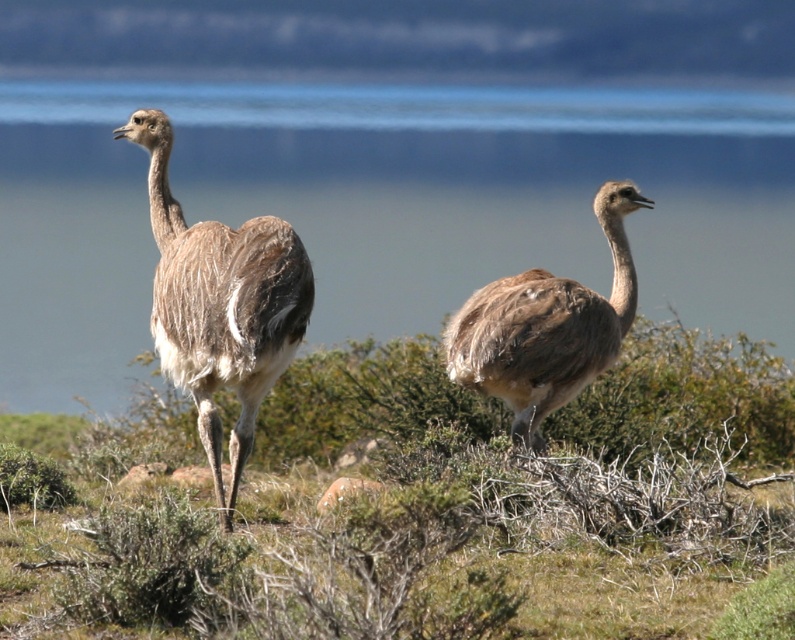
Can you confirm if blue water at center is wider than brown feathered ostrich at center?

Indeed, blue water at center has a greater width compared to brown feathered ostrich at center.

Is point (33, 330) farther from viewer compared to point (569, 355)?

Yes, it is.

Identify the location of blue water at center. Image resolution: width=795 pixels, height=640 pixels. (382, 205).

Is brown feathered ostrich at left to the left of brown feathered ostrich at center from the viewer's perspective?

Indeed, brown feathered ostrich at left is positioned on the left side of brown feathered ostrich at center.

Does point (223, 504) come behind point (615, 346)?

That is False.

Image resolution: width=795 pixels, height=640 pixels. I want to click on brown feathered ostrich at left, so click(x=220, y=305).

Does blue water at center have a greater height compared to brown feathered ostrich at left?

Yes, blue water at center is taller than brown feathered ostrich at left.

Can you confirm if blue water at center is positioned below brown feathered ostrich at left?

No.

This screenshot has width=795, height=640. What do you see at coordinates (382, 205) in the screenshot?
I see `blue water at center` at bounding box center [382, 205].

Where is `blue water at center`? This screenshot has width=795, height=640. blue water at center is located at coordinates (382, 205).